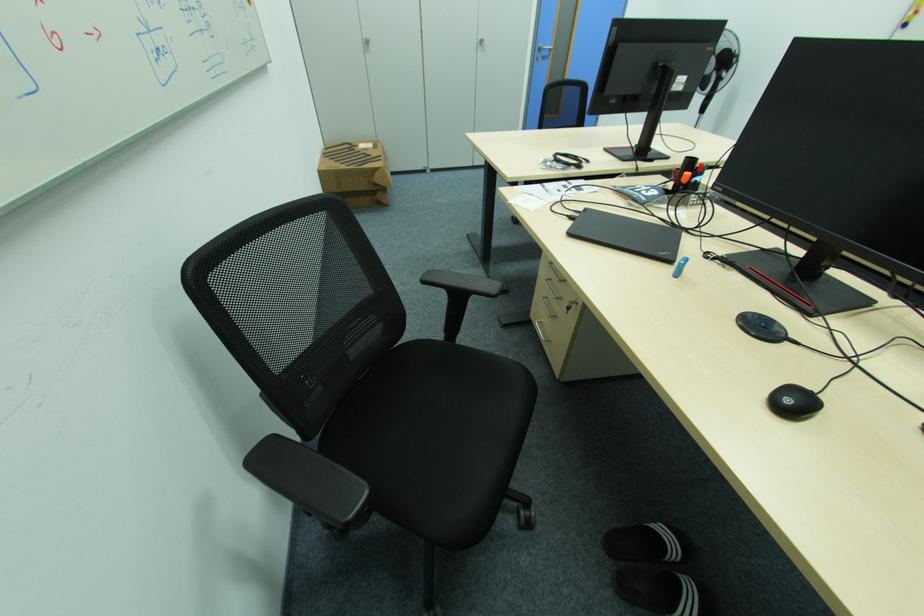
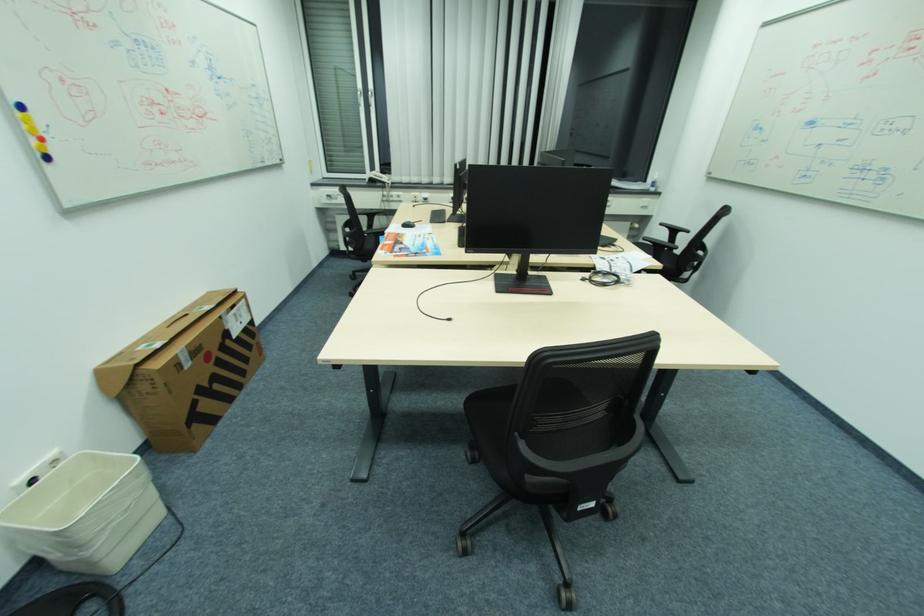
Where in the second image is the point corresponding to the point at 515,201 from the first image?

(657, 257)